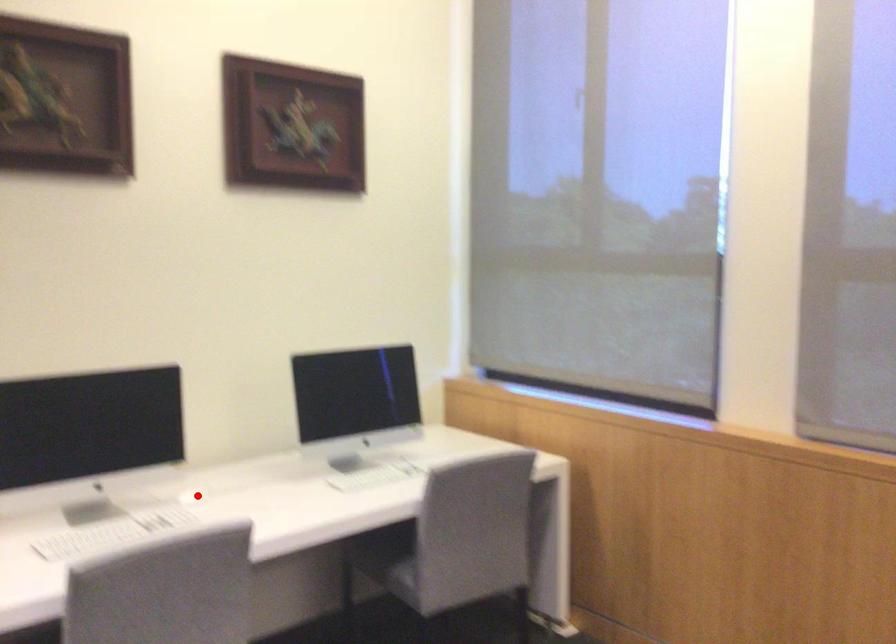
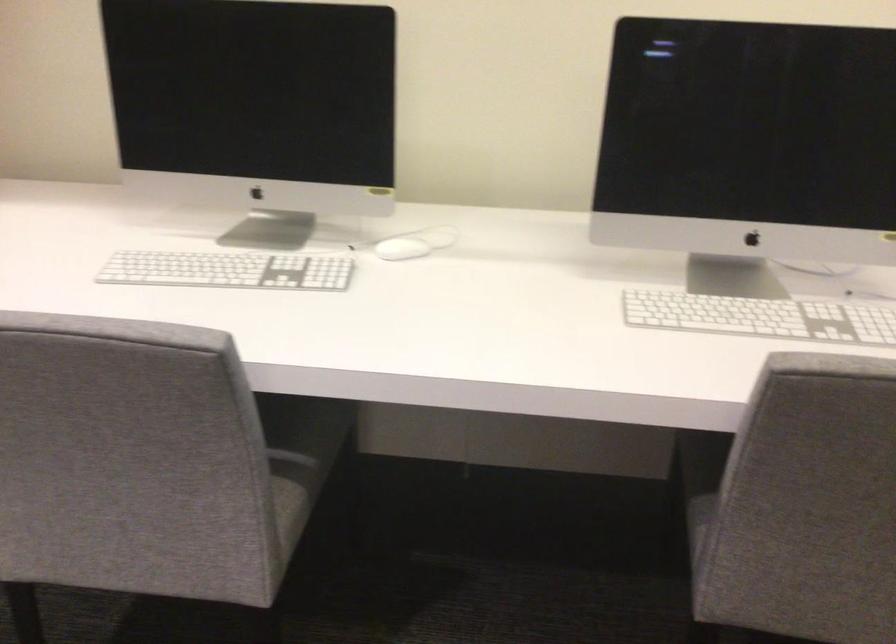
Question: I am providing you with two images of the same scene from different viewpoints. Image1 has a red point marked. In image2, the corresponding 3D location appears at what relative position? Reply with the corresponding letter.

Choices:
 (A) Closer
 (B) Farther

Answer: (A)